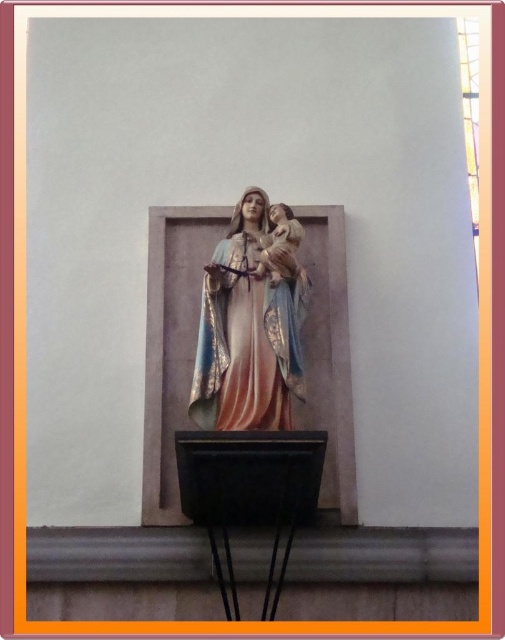
Question: Can you confirm if matte painted statue at center is positioned to the right of transparent glass window at upper right?

Choices:
 (A) no
 (B) yes

Answer: (A)

Question: Which object appears farthest from the camera in this image?

Choices:
 (A) transparent glass window at upper right
 (B) matte painted statue at center

Answer: (A)

Question: Is matte painted statue at center bigger than transparent glass window at upper right?

Choices:
 (A) no
 (B) yes

Answer: (A)

Question: Is matte painted statue at center above transparent glass window at upper right?

Choices:
 (A) yes
 (B) no

Answer: (B)